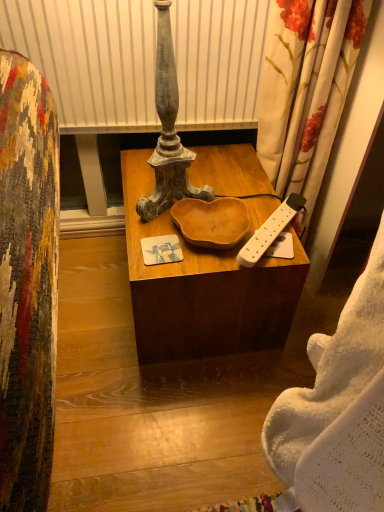
You are a GUI agent. You are given a task and a screenshot of the screen. Output one action in this format:
    pyautogui.click(x=<x>, y=<y>)
    Task: Click on the white knitted blanket at right
    The width and height of the screenshot is (384, 512).
    Given the screenshot: What is the action you would take?
    pyautogui.click(x=338, y=408)

What is the approximate width of white plastic remote control at right?

white plastic remote control at right is 12.65 inches in width.

Where is `wooden bowl at center`? The width and height of the screenshot is (384, 512). wooden bowl at center is located at coordinates (205, 285).

Describe the element at coordinates (205, 285) in the screenshot. The width and height of the screenshot is (384, 512). I see `wooden bowl at center` at that location.

Where is `white knitted blanket at right`? white knitted blanket at right is located at coordinates (338, 408).

From a real-world perspective, does white plastic remote control at right stand above white knitted blanket at right?

No, from a real-world perspective, white plastic remote control at right is not on top of white knitted blanket at right.

Which is correct: white plastic remote control at right is inside white knitted blanket at right, or outside of it?

The correct answer is: outside.

Is white plastic remote control at right wider or thinner than white knitted blanket at right?

Clearly, white plastic remote control at right has less width compared to white knitted blanket at right.

Consider the image. Does white plastic remote control at right turn towards white knitted blanket at right?

No, white plastic remote control at right is not facing towards white knitted blanket at right.

Is white knitted blanket at right wider than white plastic remote control at right?

Correct, the width of white knitted blanket at right exceeds that of white plastic remote control at right.

Is white knitted blanket at right facing towards white plastic remote control at right?

No, white knitted blanket at right is not oriented towards white plastic remote control at right.

From a real-world perspective, which is physically above, white knitted blanket at right or white plastic remote control at right?

In real-world perspective, white knitted blanket at right is above.

From their relative heights in the image, would you say white knitted blanket at right is taller or shorter than white plastic remote control at right?

Considering their sizes, white knitted blanket at right has more height than white plastic remote control at right.

Between white knitted blanket at right and wooden bowl at center, which one has larger width?

wooden bowl at center is wider.

Is white knitted blanket at right positioned far away from wooden bowl at center?

They are positioned close to each other.

Looking at this image, between white knitted blanket at right and wooden bowl at center, which one has smaller size?

Smaller between the two is white knitted blanket at right.

Considering the positions of objects white knitted blanket at right and wooden bowl at center in the image provided, who is behind, white knitted blanket at right or wooden bowl at center?

wooden bowl at center.

Which of these two, white plastic remote control at right or wooden bowl at center, stands taller?

wooden bowl at center is taller.

Between white plastic remote control at right and wooden bowl at center, which one appears on the right side from the viewer's perspective?

From the viewer's perspective, white plastic remote control at right appears more on the right side.

How much distance is there between white plastic remote control at right and wooden bowl at center?

They are 8.23 inches apart.

Is white plastic remote control at right placed right next to wooden bowl at center?

No, white plastic remote control at right is not next to wooden bowl at center.

How many degrees apart are the facing directions of wooden bowl at center and white knitted blanket at right?

38.5 degrees.

Who is bigger, wooden bowl at center or white knitted blanket at right?

wooden bowl at center.

Can you confirm if wooden bowl at center is thinner than white knitted blanket at right?

Incorrect, the width of wooden bowl at center is not less than that of white knitted blanket at right.

Does wooden bowl at center have a smaller size compared to white plastic remote control at right?

No.

From a real-world perspective, who is located higher, wooden bowl at center or white plastic remote control at right?

white plastic remote control at right is physically above.

Which object is closer to the camera, wooden bowl at center or white plastic remote control at right?

white plastic remote control at right is closer to the camera.

Between wooden bowl at center and white plastic remote control at right, which one appears on the left side from the viewer's perspective?

wooden bowl at center.

The width and height of the screenshot is (384, 512). What are the coordinates of `blanket that is above the white plastic remote control at right (from a real-world perspective)` in the screenshot? It's located at (338, 408).

You are a GUI agent. You are given a task and a screenshot of the screen. Output one action in this format:
    pyautogui.click(x=<x>, y=<y>)
    Task: Click on the blanket on the right of white plastic remote control at right
    This screenshot has width=384, height=512.
    Given the screenshot: What is the action you would take?
    pyautogui.click(x=338, y=408)

Estimate the real-world distances between objects in this image. Which object is further from white plastic remote control at right, wooden bowl at center or white knitted blanket at right?

white knitted blanket at right lies further to white plastic remote control at right than the other object.

Looking at the image, which one is located closer to white knitted blanket at right, white plastic remote control at right or wooden bowl at center?

white plastic remote control at right is closer to white knitted blanket at right.

Looking at the image, which one is located further to white knitted blanket at right, wooden bowl at center or white plastic remote control at right?

wooden bowl at center.

Based on their spatial positions, is white knitted blanket at right or white plastic remote control at right closer to wooden bowl at center?

Among the two, white plastic remote control at right is located nearer to wooden bowl at center.

Considering their positions, is white knitted blanket at right positioned further to white plastic remote control at right than wooden bowl at center?

white knitted blanket at right is further to white plastic remote control at right.

Looking at the image, which one is located closer to wooden bowl at center, white plastic remote control at right or white knitted blanket at right?

Among the two, white plastic remote control at right is located nearer to wooden bowl at center.

At what (x,y) coordinates should I click in order to perform the action: click on remote control positioned between white knitted blanket at right and wooden bowl at center from near to far. Please return your answer as a coordinate pair (x, y). The height and width of the screenshot is (512, 384). Looking at the image, I should click on (270, 230).